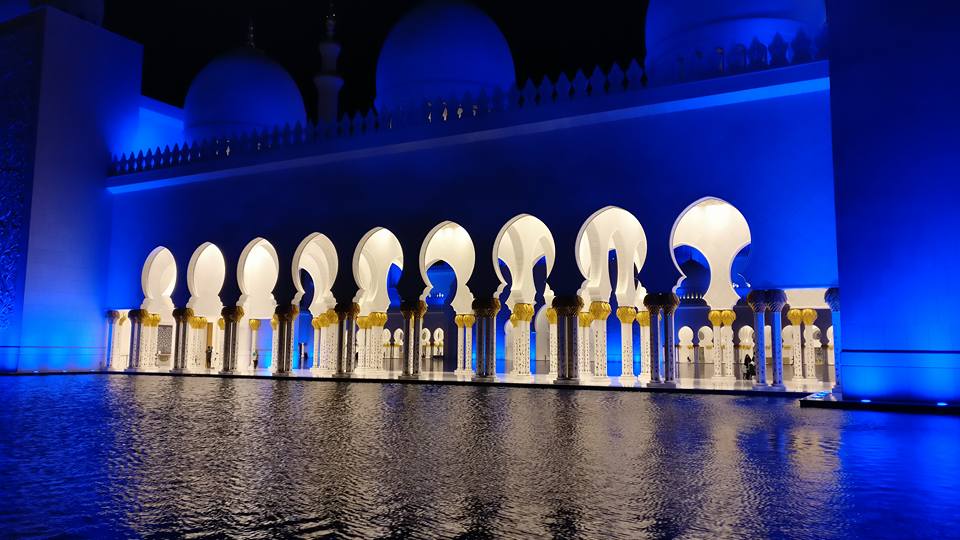
Locate an element on the screen. wall is located at coordinates (679, 167).